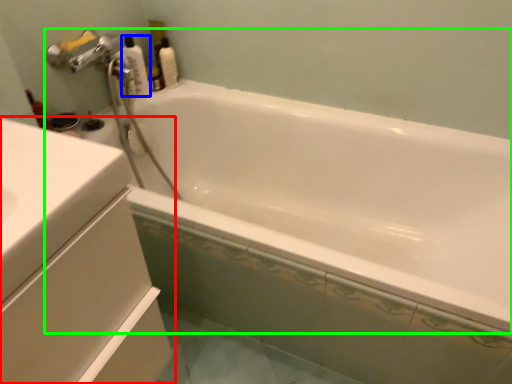
Question: Which object is positioned farthest from bathroom cabinet (highlighted by a red box)? Select from cleaning product (highlighted by a blue box) and bathtub (highlighted by a green box).

Choices:
 (A) cleaning product
 (B) bathtub

Answer: (A)